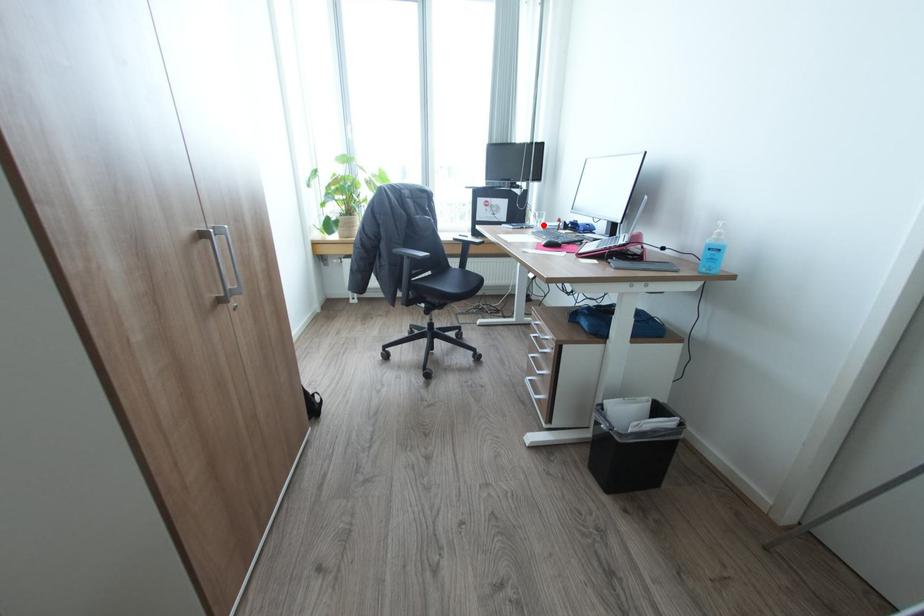
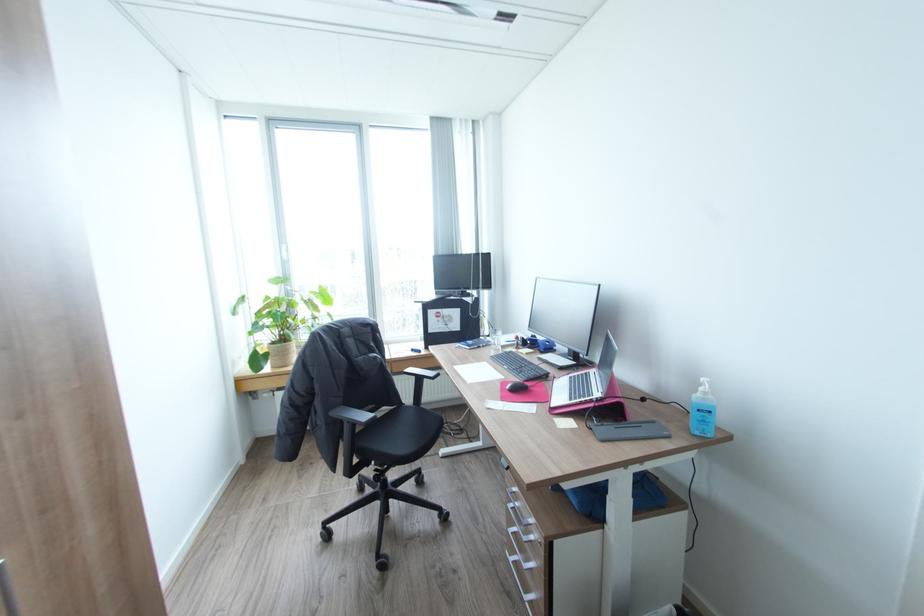
Find the pixel in the second image that matches the highlighted location in the first image.

(502, 344)